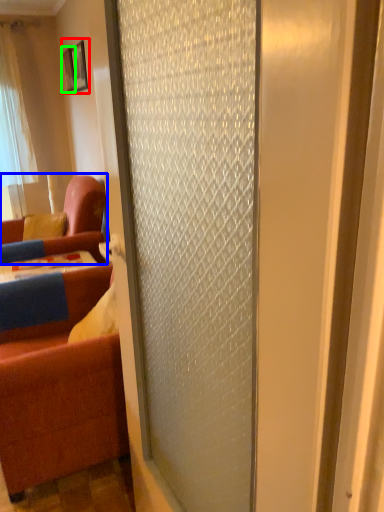
Question: Considering the real-world distances, which object is farthest from picture frame (highlighted by a red box)? studio couch (highlighted by a blue box) or picture frame (highlighted by a green box)?

Choices:
 (A) studio couch
 (B) picture frame

Answer: (A)